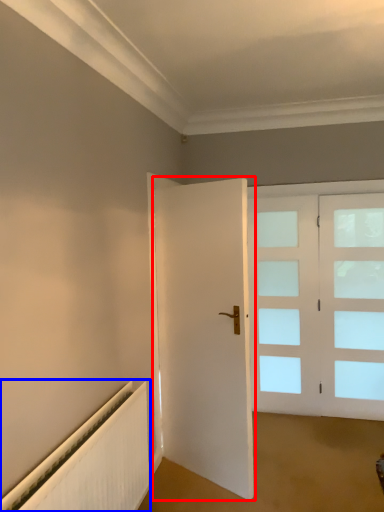
Question: Which of the following is the farthest to the observer, door (highlighted by a red box) or radiator (highlighted by a blue box)?

Choices:
 (A) door
 (B) radiator

Answer: (A)